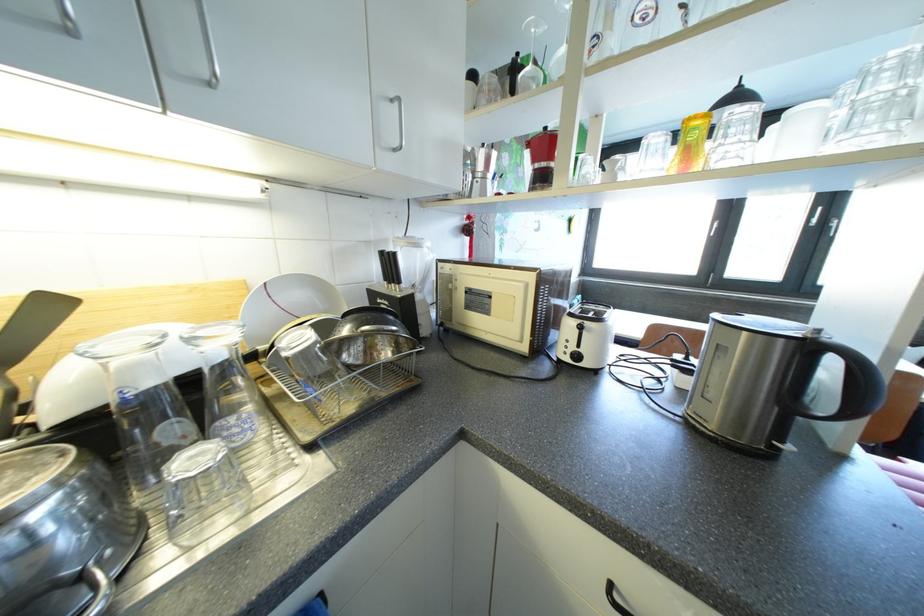
At what (x,y) coordinates should I click in order to perform the action: click on white plate. Please return your answer as a coordinate pair (x, y). Looking at the image, I should click on (286, 305).